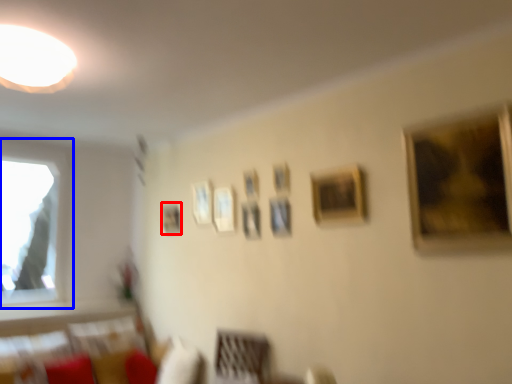
Question: Which object is closer to the camera taking this photo, picture frame (highlighted by a red box) or window (highlighted by a blue box)?

Choices:
 (A) picture frame
 (B) window

Answer: (B)